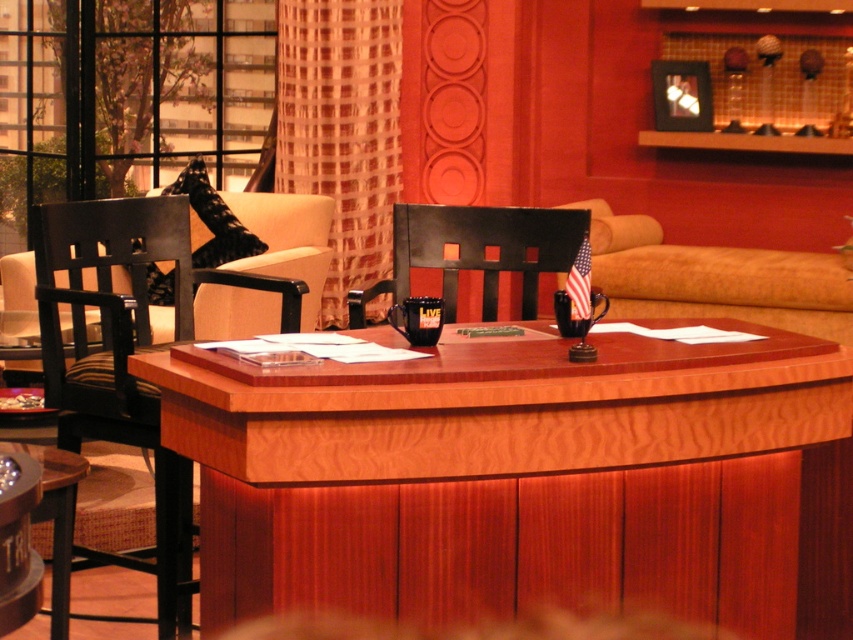
Question: Does wooden desk at center have a lesser width compared to wooden table at lower left?

Choices:
 (A) no
 (B) yes

Answer: (A)

Question: Observing the image, what is the correct spatial positioning of black wood chair at left in reference to black leather chair at center?

Choices:
 (A) below
 (B) above

Answer: (A)

Question: Which point is farther from the camera taking this photo?

Choices:
 (A) coord(102,355)
 (B) coord(473,612)

Answer: (A)

Question: Which of the following is the farthest from the observer?

Choices:
 (A) black wood chair at left
 (B) wooden desk at center
 (C) black leather chair at center
 (D) wooden table at lower left

Answer: (C)

Question: Is wooden desk at center bigger than black wood chair at left?

Choices:
 (A) yes
 (B) no

Answer: (A)

Question: Based on their relative distances, which object is nearer to the wooden desk at center?

Choices:
 (A) black leather chair at center
 (B) black wood chair at left

Answer: (A)